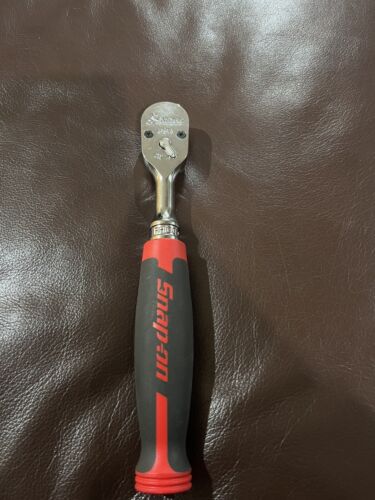
Find the location of a particular element. The image size is (375, 500). small gray screws is located at coordinates (149, 134), (181, 134).